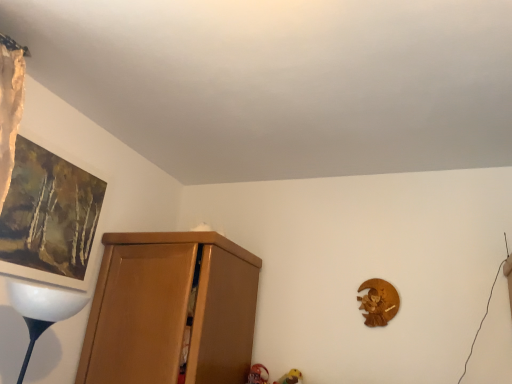
Question: Looking at the image, does matte wood cupboard at left seem bigger or smaller compared to matte brown picture frame at upper left?

Choices:
 (A) small
 (B) big

Answer: (B)

Question: Considering the relative positions of matte wood cupboard at left and matte brown picture frame at upper left in the image provided, is matte wood cupboard at left to the left or to the right of matte brown picture frame at upper left?

Choices:
 (A) left
 (B) right

Answer: (B)

Question: From the image's perspective, relative to matte brown picture frame at upper left, is matte wood cupboard at left above or below?

Choices:
 (A) below
 (B) above

Answer: (A)

Question: Does point (36, 157) appear closer or farther from the camera than point (229, 317)?

Choices:
 (A) closer
 (B) farther

Answer: (A)

Question: Looking at the image, does matte brown picture frame at upper left seem bigger or smaller compared to matte wood cupboard at left?

Choices:
 (A) big
 (B) small

Answer: (B)

Question: In the image, is matte brown picture frame at upper left positioned in front of or behind matte wood cupboard at left?

Choices:
 (A) front
 (B) behind

Answer: (A)

Question: From a real-world perspective, is matte brown picture frame at upper left above or below matte wood cupboard at left?

Choices:
 (A) below
 (B) above

Answer: (B)